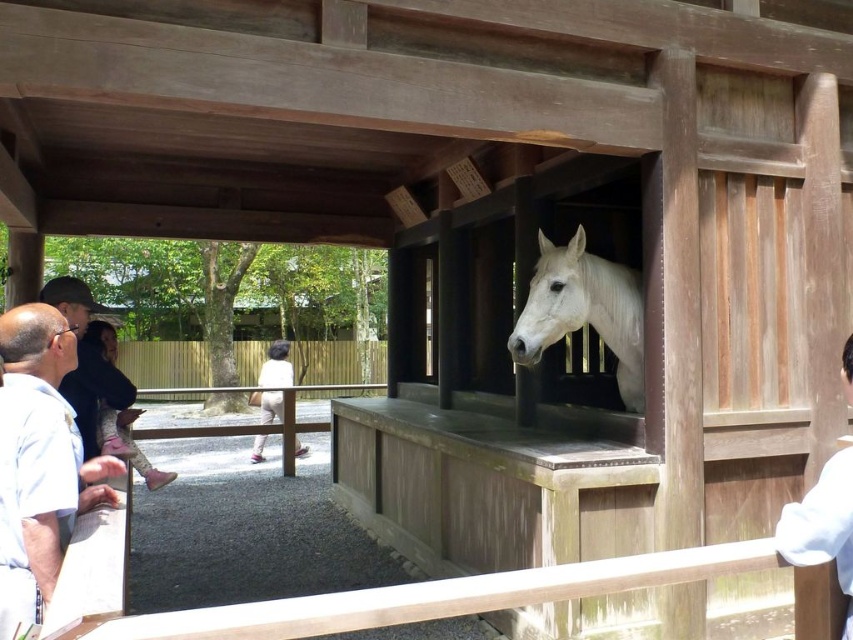
Question: Among these points, which one is nearest to the camera?

Choices:
 (A) (569, 298)
 (B) (93, 346)

Answer: (B)

Question: Can you confirm if bald head at left is positioned to the right of matte black cap at upper left?

Choices:
 (A) no
 (B) yes

Answer: (B)

Question: Which object is the closest to the bald head at left?

Choices:
 (A) white glossy horse at center
 (B) smooth brown hair at center

Answer: (B)

Question: Does matte black head at upper left come in front of smooth brown hair at center?

Choices:
 (A) yes
 (B) no

Answer: (B)

Question: Can you confirm if matte black cap at upper left is bigger than matte black head at upper left?

Choices:
 (A) yes
 (B) no

Answer: (B)

Question: Which point is closer to the camera?

Choices:
 (A) (846, 392)
 (B) (288, 348)
 (C) (100, 317)
 (D) (521, 323)

Answer: (A)